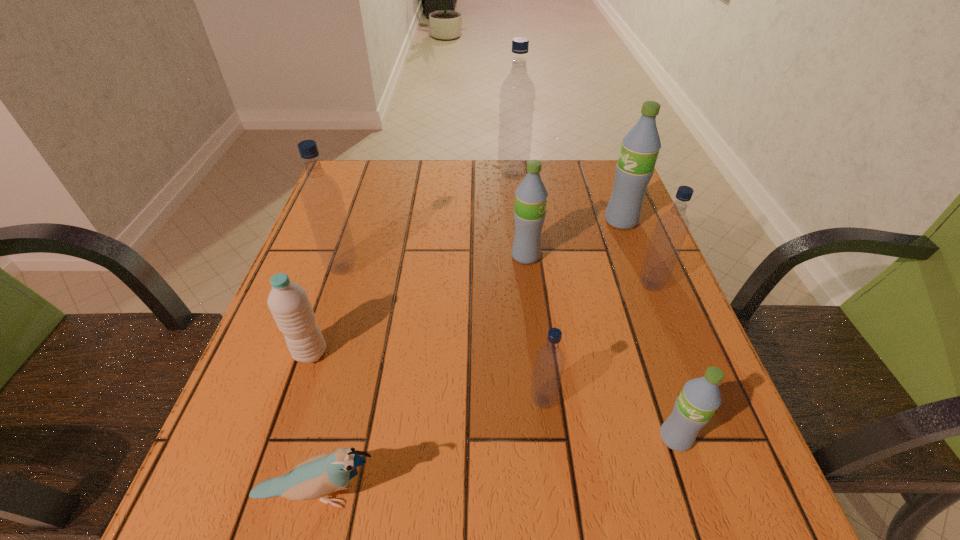
Image resolution: width=960 pixels, height=540 pixels. Find the location of `vacant space at the near edge of the desktop`. vacant space at the near edge of the desktop is located at coordinates (572, 487).

At what (x,y) coordinates should I click in order to perform the action: click on vacant area at the left edge. Please return your answer as a coordinate pair (x, y). Looking at the image, I should click on (312, 273).

In the image, there is a desktop. Identify the location of vacant space at the right edge. (602, 227).

You are a GUI agent. You are given a task and a screenshot of the screen. Output one action in this format:
    pyautogui.click(x=<x>, y=<y>)
    Task: Click on the vacant region at the far left corner of the desktop
    Image resolution: width=960 pixels, height=540 pixels.
    Given the screenshot: What is the action you would take?
    pyautogui.click(x=382, y=197)

In the image, there is a desktop. Where is `vacant space at the near left corner`? This screenshot has width=960, height=540. vacant space at the near left corner is located at coordinates (228, 497).

At what (x,y) coordinates should I click in order to perform the action: click on vacant region between the third smallest blue water bottle and the shortest object. Please return your answer as a coordinate pair (x, y). The height and width of the screenshot is (540, 960). Looking at the image, I should click on 330,382.

At what (x,y) coordinates should I click in order to perform the action: click on free spot between the leftmost green water bottle and the nearest green water bottle. Please return your answer as a coordinate pair (x, y). The height and width of the screenshot is (540, 960). Looking at the image, I should click on (601, 347).

Where is `free space between the blue bird and the farthest water bottle`? The width and height of the screenshot is (960, 540). free space between the blue bird and the farthest water bottle is located at coordinates (416, 335).

Find the location of a particular element. This screenshot has width=960, height=540. vacant space that's between the white water bottle and the leftmost blue water bottle is located at coordinates (326, 310).

At what (x,y) coordinates should I click in order to perform the action: click on empty space between the leftmost green water bottle and the eighth nearest object. Please return your answer as a coordinate pair (x, y). Looking at the image, I should click on (573, 239).